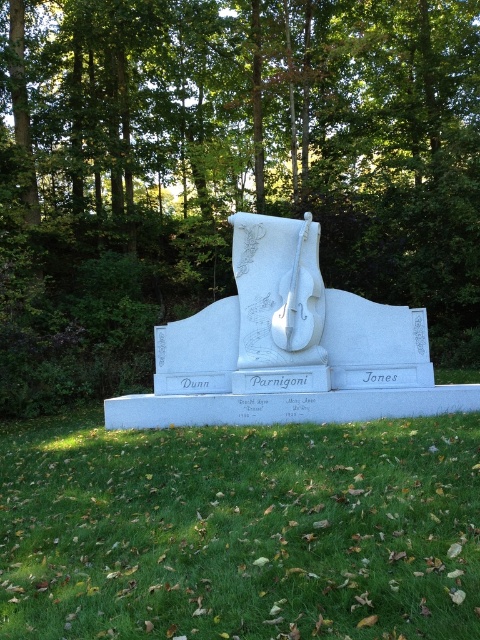
Question: Which point is closer to the camera?

Choices:
 (A) (384, 422)
 (B) (255, 193)

Answer: (A)

Question: Is green leafy tree at center smaller than green grass at lower center?

Choices:
 (A) no
 (B) yes

Answer: (A)

Question: Is green leafy tree at center positioned before green grass at lower center?

Choices:
 (A) no
 (B) yes

Answer: (A)

Question: Which of the following is the farthest from the observer?

Choices:
 (A) (68, 349)
 (B) (416, 632)

Answer: (A)

Question: Does green leafy tree at center have a larger size compared to green grass at lower center?

Choices:
 (A) no
 (B) yes

Answer: (B)